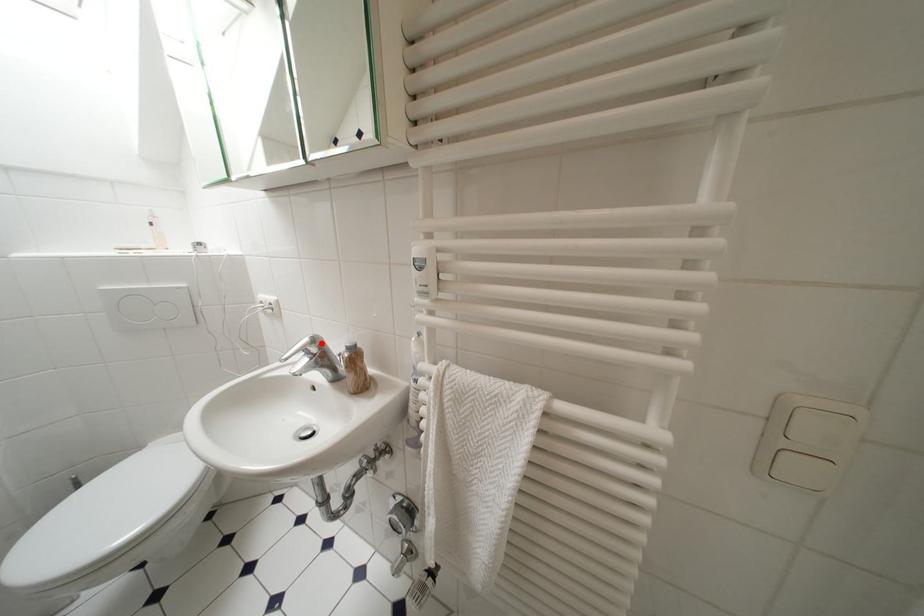
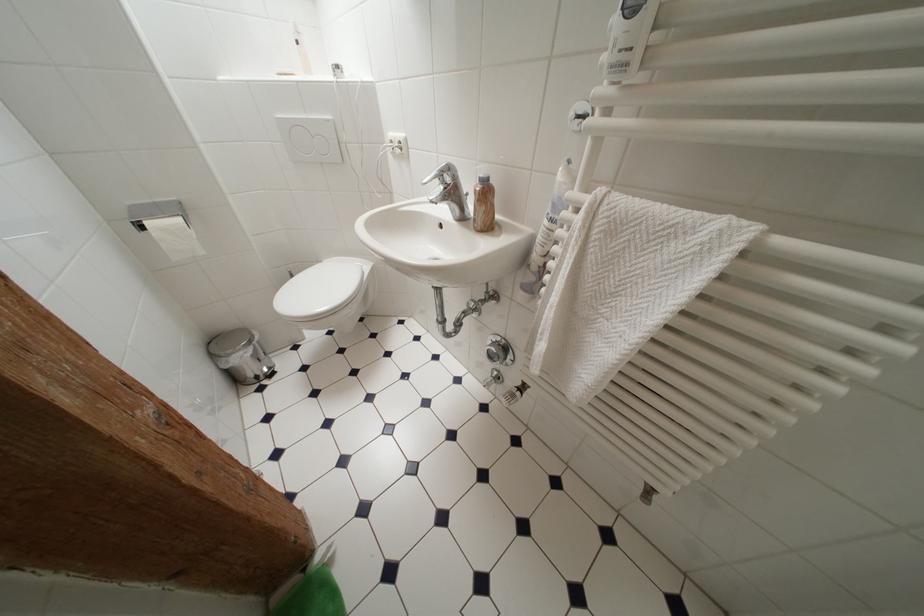
In the second image, find the point that corresponds to the highlighted location in the first image.

(456, 171)